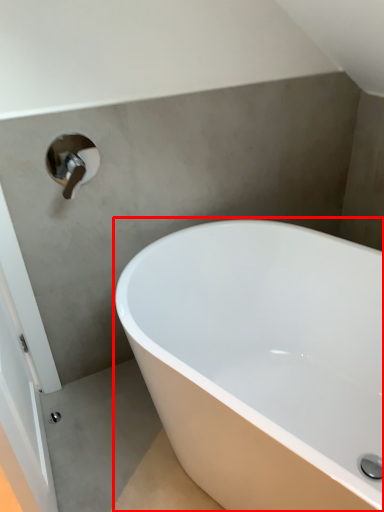
Question: From the image's perspective, what is the correct spatial positioning of bathtub (annotated by the red box) in reference to tap?

Choices:
 (A) above
 (B) below

Answer: (B)